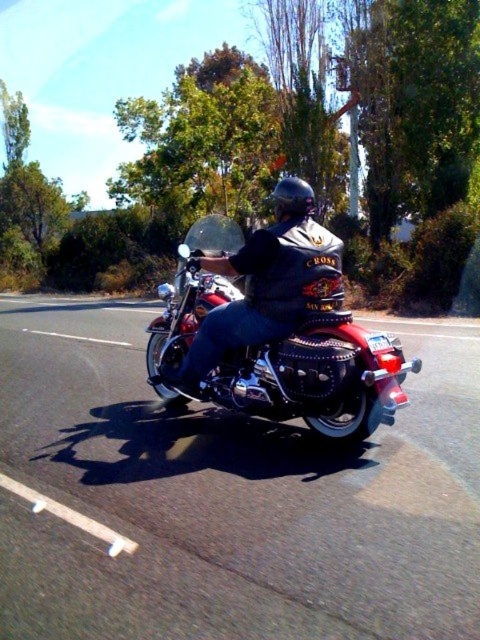
Looking at this image, you are a photographer standing at the point with coordinates (x=316, y=364). You want to take a photo of the shiny chrome motorcycle at center. Since you are exactly at its location, can you see the motorcycle in your photo?

Since you are standing at the point where the shiny chrome motorcycle at center is located, you cannot see the motorcycle in your photo because you are at the same position as it.

You are a photographer trying to capture the metallic chrome motorcycle at center and the shiny chrome motorcycle at center. Which one is positioned to the right side of the other?

The metallic chrome motorcycle at center is positioned to the right of the shiny chrome motorcycle at center.

You are standing at point (400, 483) and want to take a photo of the motorcycle and rider using a camera that has a focal length of 50mm. If the motorcycle and rider are 3.79 meters away from you, what is the approximate angle of view required to capture the entire scene in your photo?

The point (400, 483) and camera are 3.79 meters apart, so to capture the entire scene, you need an angle of view that can cover the distance of 3.79 meters at a 50mm focal length. A 50mm lens typically has an angle of view of about 46 degrees, which should be sufficient to capture the motorcycle and rider at that distance.